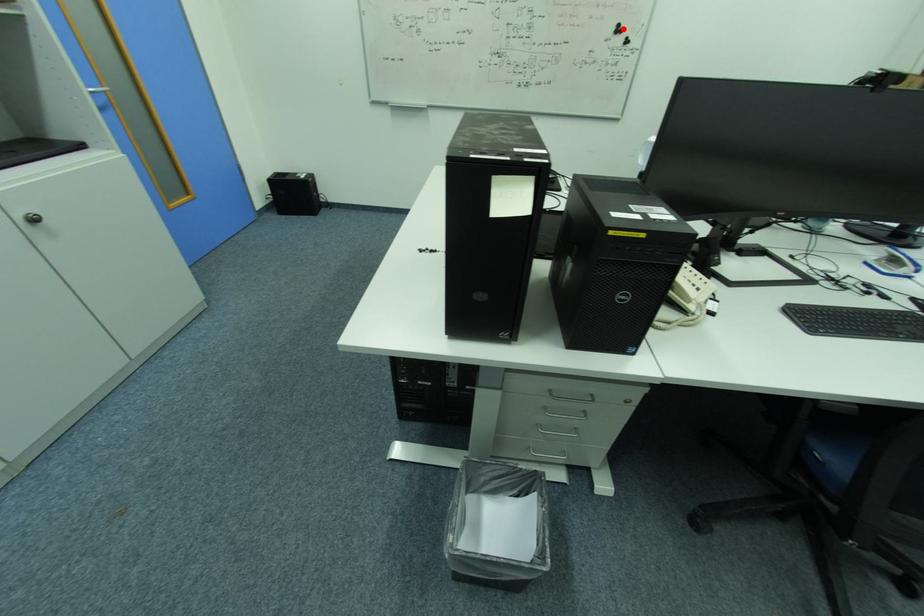
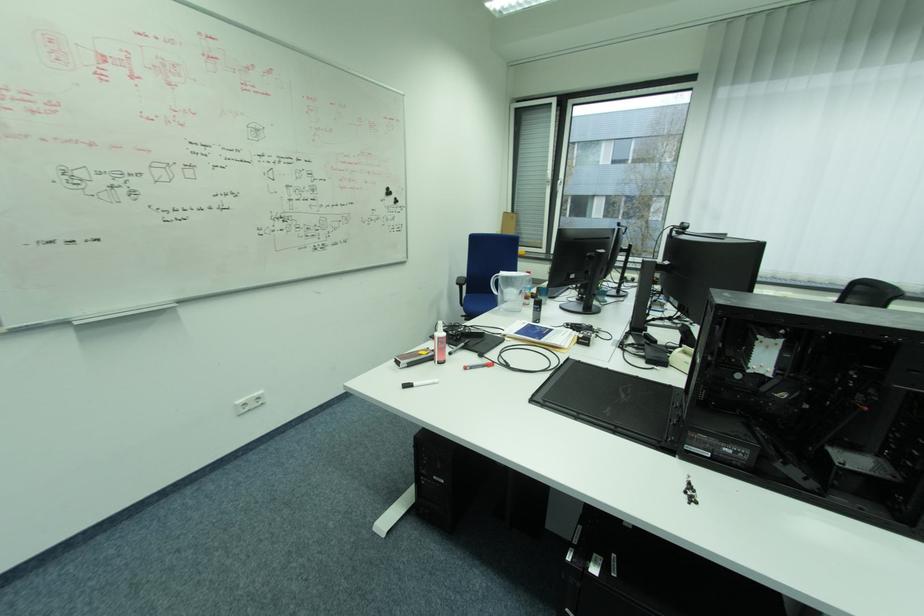
Question: I am providing you with two images of the same scene from different viewpoints. In image1, a red point is highlighted. Considering the same 3D point in image2, which of the following is correct?

Choices:
 (A) It is closer
 (B) It is farther

Answer: (A)